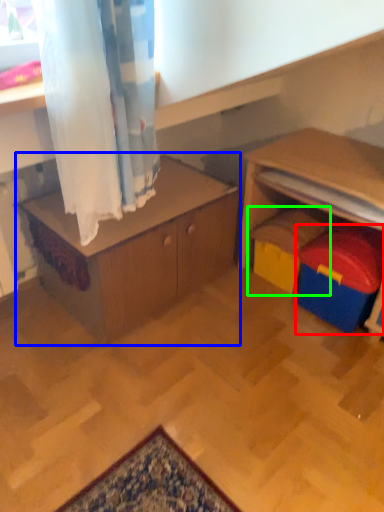
Question: Based on their relative distances, which object is nearer to toy (highlighted by a red box)? Choose from table (highlighted by a blue box) and toy (highlighted by a green box).

Choices:
 (A) table
 (B) toy

Answer: (B)